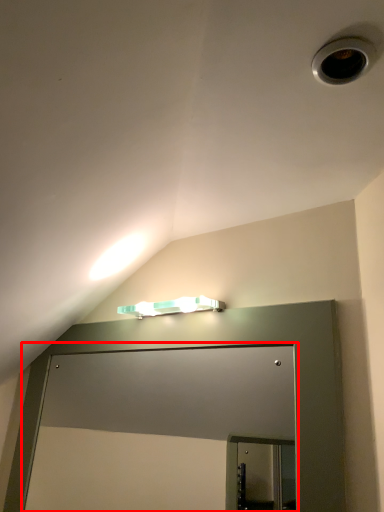
Question: Observing the image, what is the correct spatial positioning of glass door (annotated by the red box) in reference to lamp?

Choices:
 (A) right
 (B) left

Answer: (B)